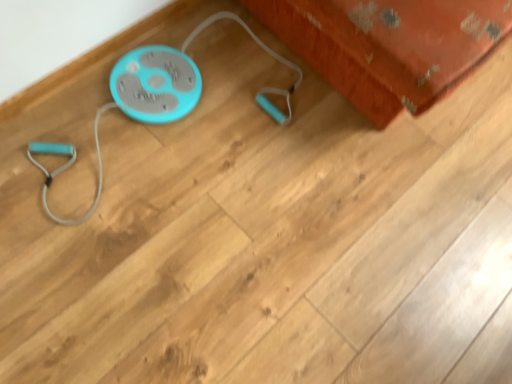
The image size is (512, 384). In order to click on vacant area that lies in front of velvet orange ottoman at lower right in this screenshot , I will do `click(358, 230)`.